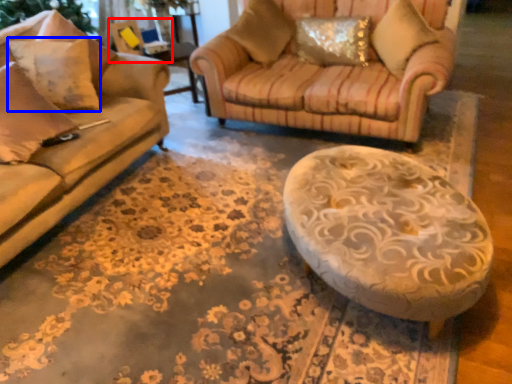
Question: Among these objects, which one is farthest to the camera, swivel chair (highlighted by a red box) or pillow (highlighted by a blue box)?

Choices:
 (A) swivel chair
 (B) pillow

Answer: (A)